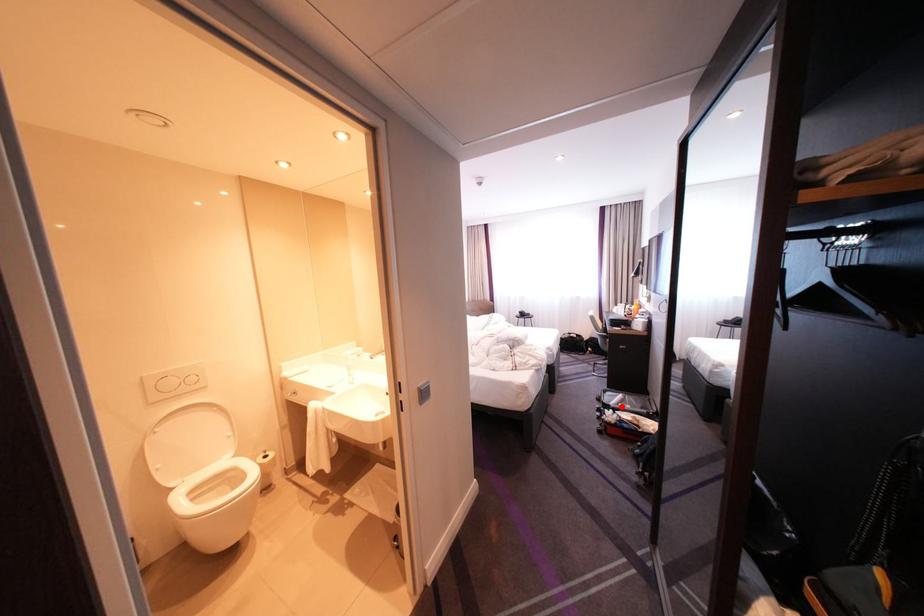
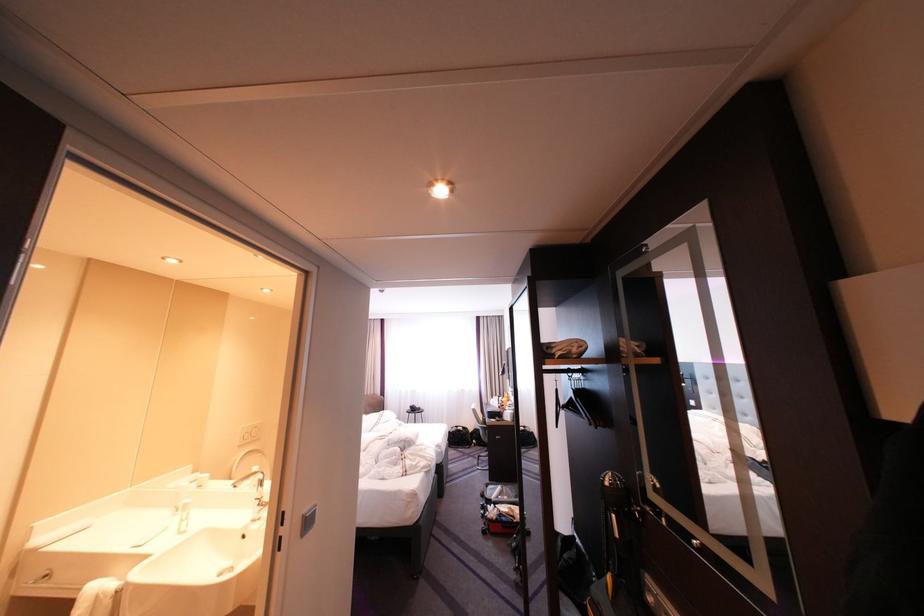
Locate, in the second image, the point that corresponds to the highlighted location in the first image.

(503, 501)